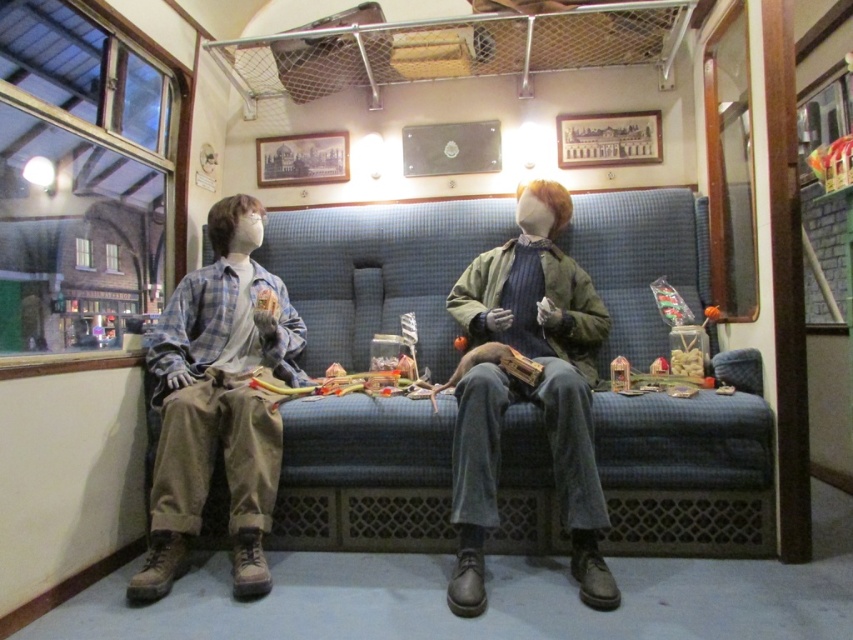
In the scene shown: You are a museum visitor who wants to take a photo of the denim shirt at left and denim jacket at center. Since you want to include both in the frame, can you tell me which one you should focus on to ensure both are visible?

The denim shirt at left is not as tall as the denim jacket at center, so focusing on the denim jacket at center would help ensure both are visible in the frame.

You are standing in the train car and want to reach the point marked at coordinates [294,419]. The mannequins are seated on the bench. Can you walk directly to that point without moving the mannequins?

The point at coordinates [294,419] is 2.34 meters away from the viewer, so yes, you can walk directly to that point without moving the mannequins as the distance is sufficient for movement.